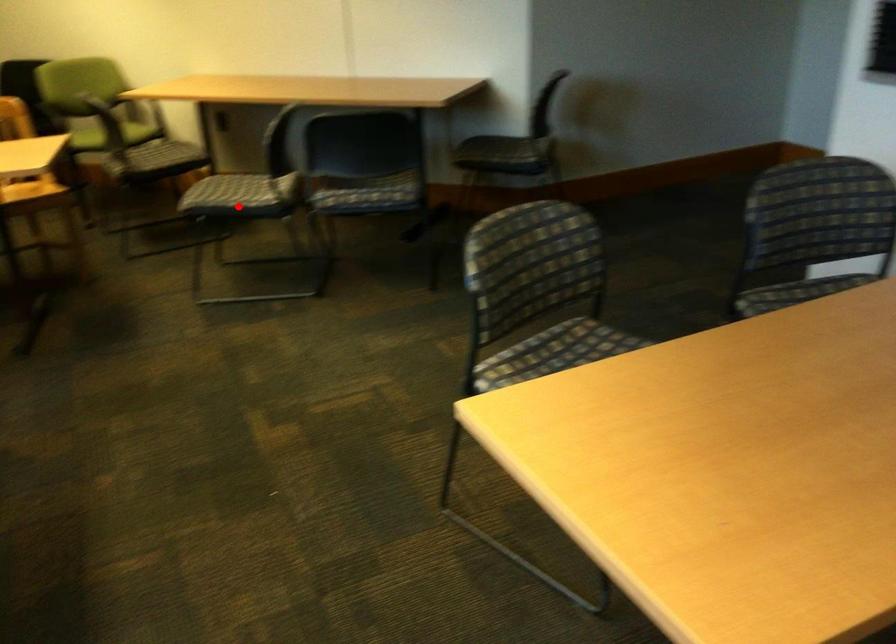
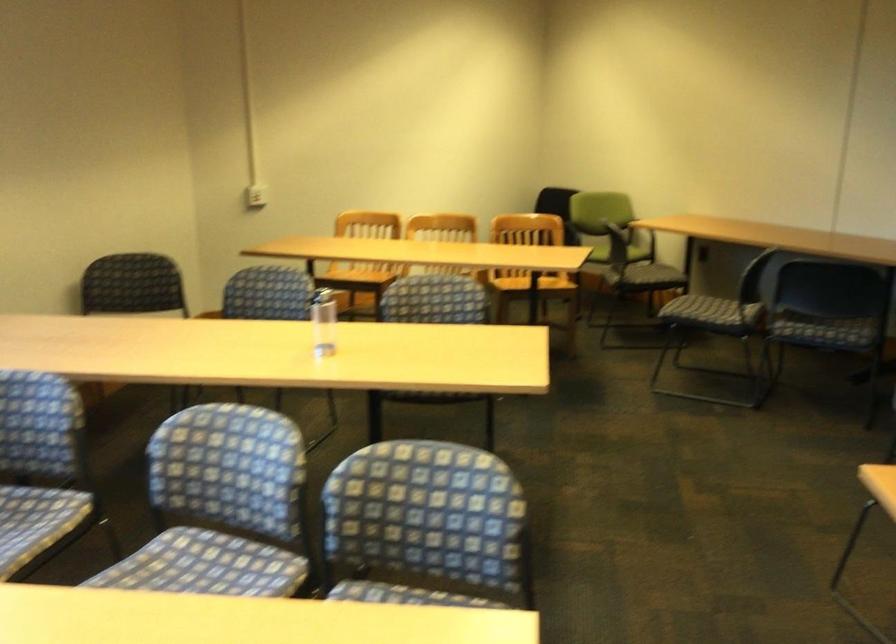
Question: I am providing you with two images of the same scene from different viewpoints. In image1, a red point is highlighted. Considering the same 3D point in image2, which of the following is correct?

Choices:
 (A) It is closer
 (B) It is farther

Answer: (B)